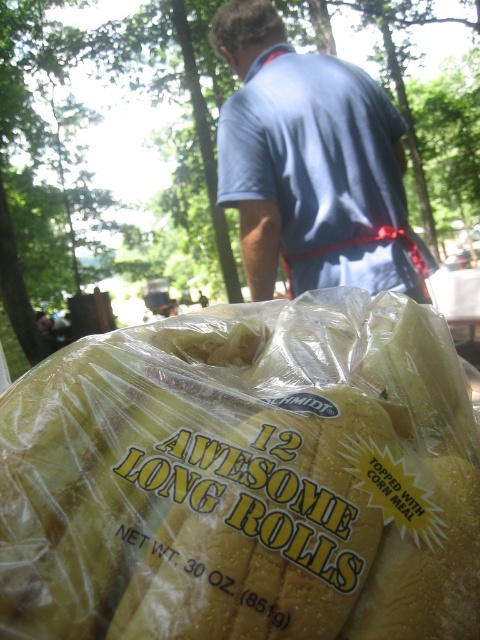
Question: Can you confirm if yellow plastic bag at bottom is positioned below blue fabric shirt at upper center?

Choices:
 (A) no
 (B) yes

Answer: (B)

Question: Does yellow plastic bag at bottom have a larger size compared to blue fabric shirt at upper center?

Choices:
 (A) yes
 (B) no

Answer: (B)

Question: Among these points, which one is farthest from the camera?

Choices:
 (A) (219, 621)
 (B) (262, 109)

Answer: (B)

Question: Is yellow plastic bag at bottom below blue fabric shirt at upper center?

Choices:
 (A) no
 (B) yes

Answer: (B)